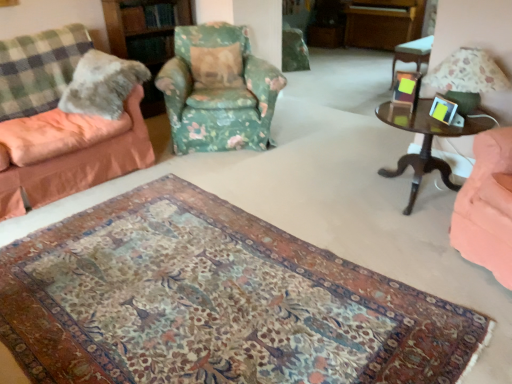
Based on the photo, what is the approximate width of fluffy fabric pillow at center, marked as the 2th pillow in a front-to-back arrangement?

fluffy fabric pillow at center, marked as the 2th pillow in a front-to-back arrangement, is 27.69 centimeters wide.

Measure the distance between point (192, 101) and camera.

Point (192, 101) is 10.59 feet from camera.

You are a GUI agent. You are given a task and a screenshot of the screen. Output one action in this format:
    pyautogui.click(x=<x>, y=<y>)
    Task: Click on the wooden table at upper right, the second table in the bottom-to-top sequence
    Image resolution: width=512 pixels, height=384 pixels.
    Given the screenshot: What is the action you would take?
    pyautogui.click(x=412, y=53)

Describe the element at coordinates (406, 88) in the screenshot. I see `metallic silver picture frame at upper right, the 1th picture frame viewed from the back` at that location.

What is the approximate width of fluffy fabric couch at left, which ranks as the second chair in right-to-left order?

The width of fluffy fabric couch at left, which ranks as the second chair in right-to-left order, is 36.09 inches.

The image size is (512, 384). I want to click on green floral fabric bookshelf at upper center, so click(146, 37).

Locate an element on the screen. fluffy fabric pillow at center, placed as the 1th pillow when sorted from right to left is located at coordinates (217, 66).

Considering the relative sizes of fuzzy fabric pillow at left, the second pillow from the back, and floral fabric armchair at center, marked as the 2th chair in a left-to-right arrangement, in the image provided, is fuzzy fabric pillow at left, the second pillow from the back, thinner than floral fabric armchair at center, marked as the 2th chair in a left-to-right arrangement,?

Correct, the width of fuzzy fabric pillow at left, the second pillow from the back, is less than that of floral fabric armchair at center, marked as the 2th chair in a left-to-right arrangement.

Can you see fuzzy fabric pillow at left, the second pillow from the back, touching floral fabric armchair at center, marked as the 1th chair in a right-to-left arrangement?

No, fuzzy fabric pillow at left, the second pillow from the back, is not in contact with floral fabric armchair at center, marked as the 1th chair in a right-to-left arrangement.

From a real-world perspective, is fuzzy fabric pillow at left, which ranks as the first pillow in front-to-back order, positioned under floral fabric armchair at center, marked as the 1th chair in a right-to-left arrangement, based on gravity?

No, from a real-world perspective, fuzzy fabric pillow at left, which ranks as the first pillow in front-to-back order, is not under floral fabric armchair at center, marked as the 1th chair in a right-to-left arrangement.

Is metallic silver picture frame at upper right, the 1th picture frame viewed from the back, inside floral carpet at center?

No, floral carpet at center does not contain metallic silver picture frame at upper right, the 1th picture frame viewed from the back.

Is floral carpet at center directly adjacent to metallic silver picture frame at upper right, which appears as the second picture frame when viewed from the front?

No, floral carpet at center is not in contact with metallic silver picture frame at upper right, which appears as the second picture frame when viewed from the front.

Is metallic silver picture frame at upper right, the 1th picture frame viewed from the back, at the back of floral carpet at center?

floral carpet at center does not have its back to metallic silver picture frame at upper right, the 1th picture frame viewed from the back.

Is metallic silver picture frame at upper right, the 1th picture frame viewed from the back, completely or partially outside of floral fabric armchair at center, marked as the 1th chair in a right-to-left arrangement?

Yes.

Is metallic silver picture frame at upper right, which appears as the second picture frame when viewed from the front, next to floral fabric armchair at center, marked as the 1th chair in a right-to-left arrangement, and touching it?

No, metallic silver picture frame at upper right, which appears as the second picture frame when viewed from the front, is not touching floral fabric armchair at center, marked as the 1th chair in a right-to-left arrangement.

From the image's perspective, between metallic silver picture frame at upper right, the 1th picture frame viewed from the back, and floral fabric armchair at center, marked as the 1th chair in a right-to-left arrangement, which one is located above?

From the image's view, floral fabric armchair at center, marked as the 1th chair in a right-to-left arrangement, is above.

How different are the orientations of metallic silver picture frame at upper right, the 1th picture frame viewed from the back, and floral fabric armchair at center, marked as the 2th chair in a left-to-right arrangement, in degrees?

They differ by 35.7 degrees in their facing directions.

From the image's perspective, is wooden table at upper right, the second table in the bottom-to-top sequence, under green floral fabric bookshelf at upper center?

No, from the image's perspective, wooden table at upper right, the second table in the bottom-to-top sequence, is not beneath green floral fabric bookshelf at upper center.

Is wooden table at upper right, the first table positioned from the back, facing away from green floral fabric bookshelf at upper center?

That's not correct — wooden table at upper right, the first table positioned from the back, is not looking away from green floral fabric bookshelf at upper center.

How different are the orientations of wooden table at upper right, the second table in the bottom-to-top sequence, and green floral fabric bookshelf at upper center in degrees?

wooden table at upper right, the second table in the bottom-to-top sequence, and green floral fabric bookshelf at upper center are facing 1.77 degrees away from each other.

Which object is positioned more to the right, wooden table at upper right, the 2th table when ordered from left to right, or green floral fabric bookshelf at upper center?

From the viewer's perspective, wooden table at upper right, the 2th table when ordered from left to right, appears more on the right side.

From the image's perspective, relative to metallic silver picture frame at right, which is the first picture frame in front-to-back order, is green floral fabric bookshelf at upper center above or below?

Based on their image positions, green floral fabric bookshelf at upper center is located above metallic silver picture frame at right, which is the first picture frame in front-to-back order.

Looking at this image, considering the relative sizes of green floral fabric bookshelf at upper center and metallic silver picture frame at right, which ranks as the second picture frame in back-to-front order, in the image provided, is green floral fabric bookshelf at upper center smaller than metallic silver picture frame at right, which ranks as the second picture frame in back-to-front order,?

No, green floral fabric bookshelf at upper center is not smaller than metallic silver picture frame at right, which ranks as the second picture frame in back-to-front order.

From a real-world perspective, relative to metallic silver picture frame at right, which ranks as the second picture frame in back-to-front order, is green floral fabric bookshelf at upper center vertically above or below?

Clearly, from a real-world perspective, green floral fabric bookshelf at upper center is below metallic silver picture frame at right, which ranks as the second picture frame in back-to-front order.

From the metallic silver picture frame at upper right, which appears as the second picture frame when viewed from the front, count the 2nd pillow to the left and point to it. Please provide its 2D coordinates.

[(102, 84)]

Does metallic silver picture frame at upper right, the 1th picture frame viewed from the back, have a lesser height compared to fuzzy fabric pillow at left, positioned as the 1th pillow in left-to-right order?

Indeed, metallic silver picture frame at upper right, the 1th picture frame viewed from the back, has a lesser height compared to fuzzy fabric pillow at left, positioned as the 1th pillow in left-to-right order.

Is metallic silver picture frame at upper right, which appears as the second picture frame when viewed from the front, with fuzzy fabric pillow at left, which is the second pillow in right-to-left order?

No, metallic silver picture frame at upper right, which appears as the second picture frame when viewed from the front, is not next to fuzzy fabric pillow at left, which is the second pillow in right-to-left order.

Which is closer, (x=412, y=105) or (x=118, y=101)?

Point (x=412, y=105) appears to be closer to the viewer than point (x=118, y=101).

From a real-world perspective, who is located lower, fluffy fabric couch at left, which ranks as the second chair in right-to-left order, or metallic silver picture frame at right, which ranks as the second picture frame in back-to-front order?

fluffy fabric couch at left, which ranks as the second chair in right-to-left order.

Considering the relative sizes of fluffy fabric couch at left, which ranks as the second chair in right-to-left order, and metallic silver picture frame at right, which is the first picture frame in front-to-back order, in the image provided, is fluffy fabric couch at left, which ranks as the second chair in right-to-left order, taller than metallic silver picture frame at right, which is the first picture frame in front-to-back order,?

Yes.

Can you confirm if fluffy fabric couch at left, the first chair from the left, is thinner than metallic silver picture frame at right, which is the first picture frame in front-to-back order?

No.

Which object is closer to the camera, fluffy fabric couch at left, which ranks as the second chair in right-to-left order, or metallic silver picture frame at right, which ranks as the second picture frame in back-to-front order?

fluffy fabric couch at left, which ranks as the second chair in right-to-left order, is in front.

From a real-world perspective, starting from the fuzzy fabric pillow at left, the second pillow from the back, which chair is the 2nd one below it? Please provide its 2D coordinates.

[(218, 90)]

Where is `picture frame that is the 2nd one when counting upward from the floral carpet at center (from the image's perspective)`? picture frame that is the 2nd one when counting upward from the floral carpet at center (from the image's perspective) is located at coordinates (406, 88).

Estimate the real-world distances between objects in this image. Which object is closer to green checkered blanket at left, floral carpet at center or wooden table at upper right, positioned as the 1th table in top-to-bottom order?

The object closer to green checkered blanket at left is floral carpet at center.

When comparing their distances from fluffy fabric couch at left, the first chair from the left, does fuzzy fabric pillow at left, which is the second pillow in right-to-left order, or metallic silver picture frame at upper right, the 1th picture frame viewed from the back, seem further?

metallic silver picture frame at upper right, the 1th picture frame viewed from the back, is positioned further to the anchor fluffy fabric couch at left, the first chair from the left.

Which object lies further to the anchor point dark wood side table at right, the 2th table from the back, fluffy fabric pillow at center, which is the second pillow from left to right, or wooden table at upper right, the first table positioned from the back?

The object further to dark wood side table at right, the 2th table from the back, is fluffy fabric pillow at center, which is the second pillow from left to right.

Considering their positions, is metallic silver picture frame at right, which ranks as the second picture frame in back-to-front order, positioned further to fluffy fabric pillow at center, marked as the 2th pillow in a front-to-back arrangement, than fuzzy fabric pillow at left, positioned as the 1th pillow in left-to-right order?

metallic silver picture frame at right, which ranks as the second picture frame in back-to-front order, lies further to fluffy fabric pillow at center, marked as the 2th pillow in a front-to-back arrangement, than the other object.

Estimate the real-world distances between objects in this image. Which object is further from fluffy fabric couch at left, which ranks as the second chair in right-to-left order, dark wood side table at right, which is the second table in right-to-left order, or floral carpet at center?

dark wood side table at right, which is the second table in right-to-left order, is further to fluffy fabric couch at left, which ranks as the second chair in right-to-left order.

Estimate the real-world distances between objects in this image. Which object is further from fluffy fabric pillow at center, which is the second pillow from left to right, dark wood side table at right, which is the first table in left-to-right order, or green floral fabric bookshelf at upper center?

dark wood side table at right, which is the first table in left-to-right order, is positioned further to the anchor fluffy fabric pillow at center, which is the second pillow from left to right.

When comparing their distances from floral fabric armchair at center, marked as the 1th chair in a right-to-left arrangement, does green checkered blanket at left or dark wood side table at right, the 2th table from the back, seem closer?

green checkered blanket at left.

Based on their spatial positions, is metallic silver picture frame at upper right, which appears as the second picture frame when viewed from the front, or dark wood side table at right, which is the first table in left-to-right order, closer to fluffy fabric couch at left, which ranks as the second chair in right-to-left order?

dark wood side table at right, which is the first table in left-to-right order, is closer to fluffy fabric couch at left, which ranks as the second chair in right-to-left order.

In order to click on pillow between fluffy fabric couch at left, which ranks as the second chair in right-to-left order, and fluffy fabric pillow at center, marked as the 2th pillow in a front-to-back arrangement, along the z-axis in this screenshot , I will do `click(102, 84)`.

Identify the location of mat between green checkered blanket at left and metallic silver picture frame at upper right, the 1th picture frame viewed from the back, in the horizontal direction. (213, 302).

I want to click on chair located between green floral fabric bookshelf at upper center and metallic silver picture frame at right, which is the first picture frame in front-to-back order, in the left-right direction, so 218,90.

I want to click on chair between fuzzy fabric pillow at left, the second pillow from the back, and dark wood side table at right, the 2th table from the back, so click(x=218, y=90).